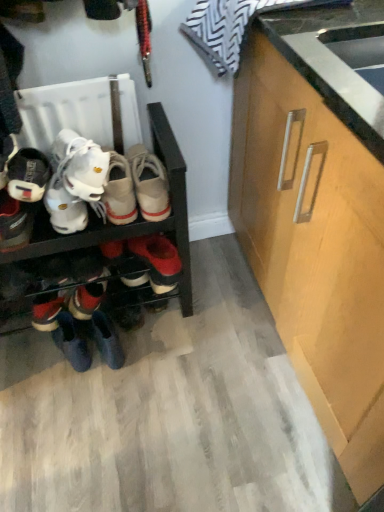
Question: Is matte black sneaker at left, which is the 2th footwear from bottom to top, touching matte black shoe at left, marked as the 3th footwear in a bottom-to-top arrangement?

Choices:
 (A) yes
 (B) no

Answer: (A)

Question: From the image's perspective, would you say matte black sneaker at left, which is the 2th footwear from bottom to top, is positioned over matte black shoe at left, marked as the 3th footwear in a bottom-to-top arrangement?

Choices:
 (A) no
 (B) yes

Answer: (A)

Question: Considering the relative sizes of matte black sneaker at left, which is the 2th footwear from bottom to top, and matte black shoe at left, the first footwear positioned from the top, in the image provided, is matte black sneaker at left, which is the 2th footwear from bottom to top, bigger than matte black shoe at left, the first footwear positioned from the top,?

Choices:
 (A) no
 (B) yes

Answer: (B)

Question: Does matte black sneaker at left, which is the 2th footwear from bottom to top, have a greater height compared to matte black shoe at left, the first footwear positioned from the top?

Choices:
 (A) yes
 (B) no

Answer: (B)

Question: Is matte black sneaker at left, which is the 2th footwear from bottom to top, shorter than matte black shoe at left, the first footwear positioned from the top?

Choices:
 (A) yes
 (B) no

Answer: (A)

Question: In terms of width, does leather boot at lower left, the first footwear positioned from the bottom, look wider or thinner when compared to light wood cabinet at right?

Choices:
 (A) thin
 (B) wide

Answer: (A)

Question: In the image, is leather boot at lower left, which appears as the third footwear when viewed from the top, positioned in front of or behind light wood cabinet at right?

Choices:
 (A) front
 (B) behind

Answer: (B)

Question: From the image's perspective, is leather boot at lower left, which appears as the third footwear when viewed from the top, above or below light wood cabinet at right?

Choices:
 (A) above
 (B) below

Answer: (B)

Question: In terms of height, does leather boot at lower left, which appears as the third footwear when viewed from the top, look taller or shorter compared to light wood cabinet at right?

Choices:
 (A) short
 (B) tall

Answer: (A)

Question: Is matte black shoe at left, marked as the 3th footwear in a bottom-to-top arrangement, taller or shorter than matte black sneaker at left, which is the 2th footwear from bottom to top?

Choices:
 (A) short
 (B) tall

Answer: (B)

Question: In the image, is matte black shoe at left, marked as the 3th footwear in a bottom-to-top arrangement, positioned in front of or behind matte black sneaker at left, which is the 2th footwear from bottom to top?

Choices:
 (A) front
 (B) behind

Answer: (A)

Question: From the image's perspective, is matte black shoe at left, marked as the 3th footwear in a bottom-to-top arrangement, positioned above or below matte black sneaker at left, which is the second footwear from top to bottom?

Choices:
 (A) above
 (B) below

Answer: (A)

Question: Based on their positions, is matte black shoe at left, marked as the 3th footwear in a bottom-to-top arrangement, located to the left or right of matte black sneaker at left, which is the 2th footwear from bottom to top?

Choices:
 (A) left
 (B) right

Answer: (A)

Question: In terms of height, does matte black sneaker at left, which is the second footwear from top to bottom, look taller or shorter compared to matte black shoe at left, the first footwear positioned from the top?

Choices:
 (A) tall
 (B) short

Answer: (B)

Question: In the image, is matte black sneaker at left, which is the second footwear from top to bottom, positioned in front of or behind matte black shoe at left, marked as the 3th footwear in a bottom-to-top arrangement?

Choices:
 (A) front
 (B) behind

Answer: (B)